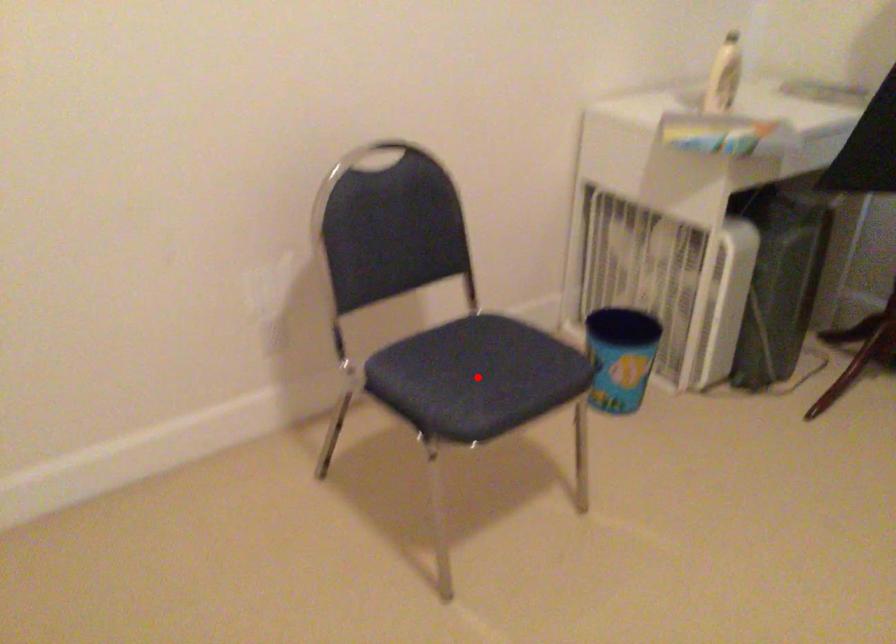
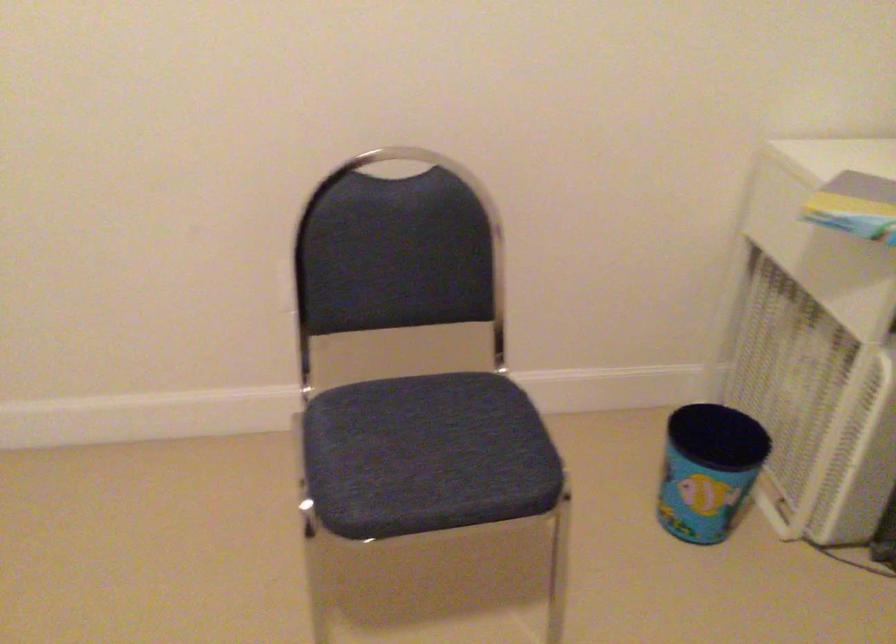
Question: A red point is marked in image1. In image2, is the corresponding 3D point closer to the camera or farther? Reply with the corresponding letter.

Choices:
 (A) The corresponding 3D point is closer.
 (B) The corresponding 3D point is farther.

Answer: (A)